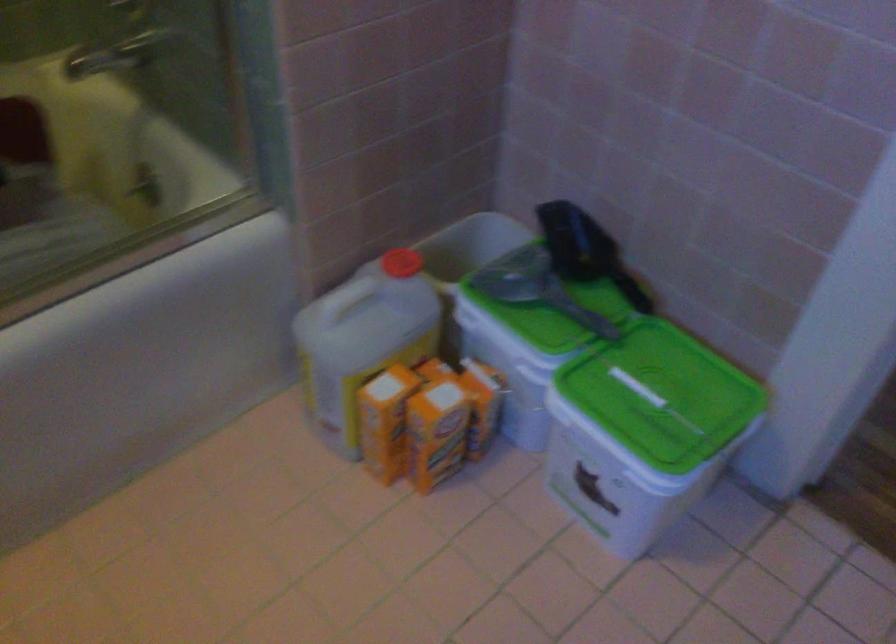
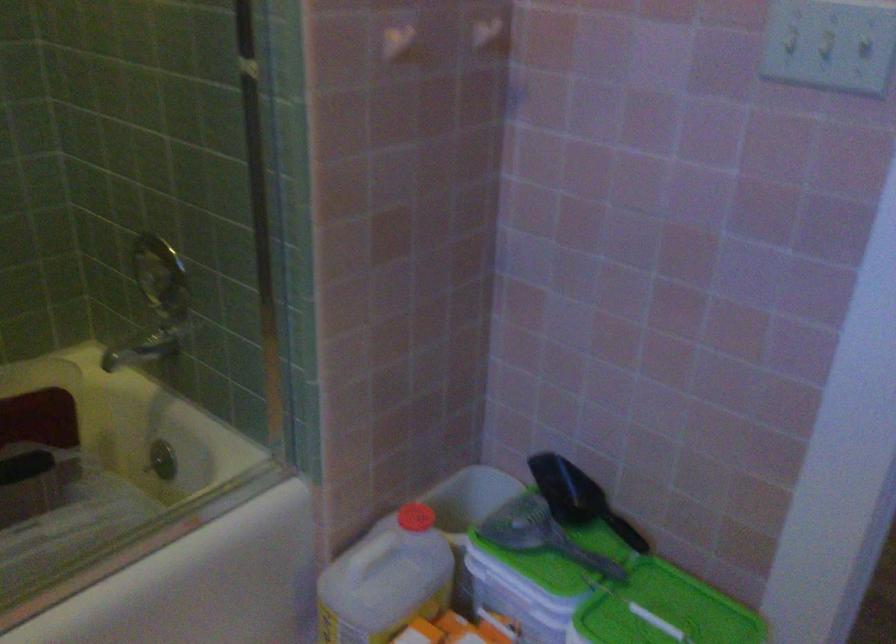
Question: How did the camera likely rotate?

Choices:
 (A) Left
 (B) Right
 (C) Up
 (D) Down

Answer: (C)